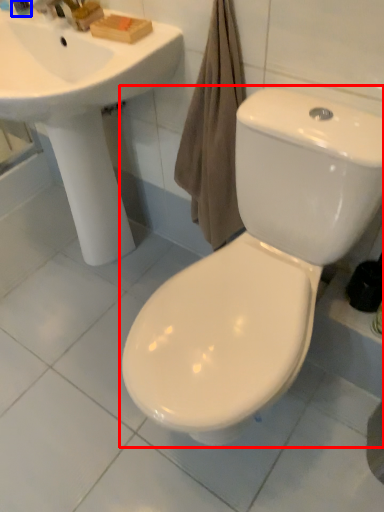
Question: Among these objects, which one is farthest to the camera, toilet (highlighted by a red box) or toiletry (highlighted by a blue box)?

Choices:
 (A) toilet
 (B) toiletry

Answer: (B)